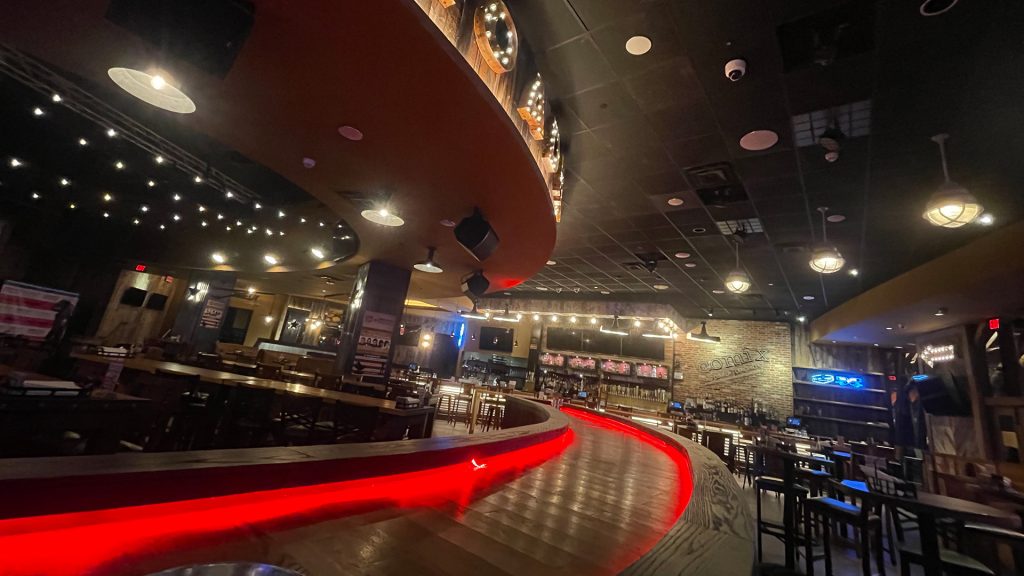
Image resolution: width=1024 pixels, height=576 pixels. In order to click on ceiling in this screenshot , I will do `click(672, 140)`.